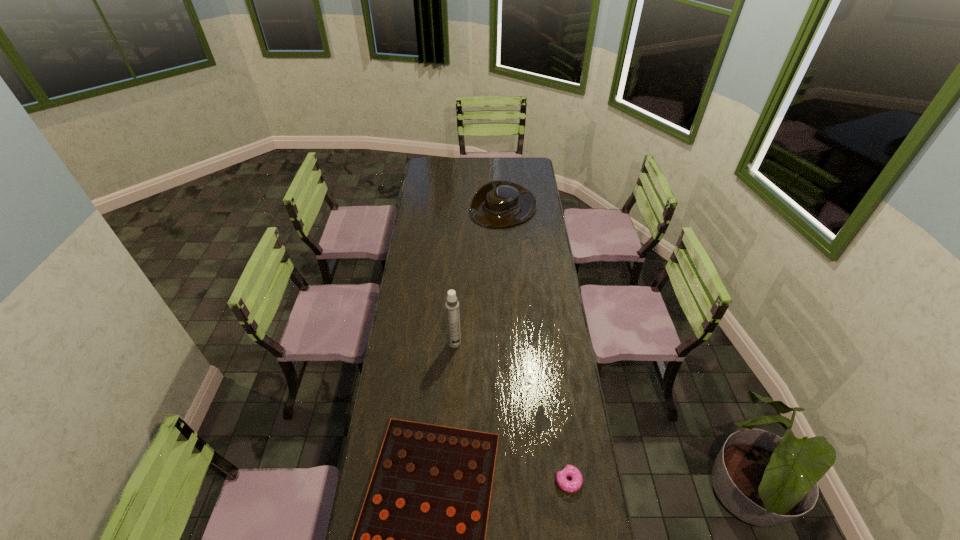
You are a GUI agent. You are given a task and a screenshot of the screen. Output one action in this format:
    pyautogui.click(x=<x>, y=<y>)
    Task: Click on the vacant region at the far edge of the desktop
    The image size is (960, 540).
    Given the screenshot: What is the action you would take?
    pyautogui.click(x=458, y=164)

The width and height of the screenshot is (960, 540). In the image, there is a desktop. Identify the location of vacant space at the left edge. (414, 275).

Identify the location of vacant space at the right edge of the desktop. (592, 522).

You are a GUI agent. You are given a task and a screenshot of the screen. Output one action in this format:
    pyautogui.click(x=<x>, y=<y>)
    Task: Click on the blank area at the far left corner
    The image size is (960, 540).
    Given the screenshot: What is the action you would take?
    pyautogui.click(x=436, y=172)

You are a GUI agent. You are given a task and a screenshot of the screen. Output one action in this format:
    pyautogui.click(x=<x>, y=<y>)
    Task: Click on the vacant area at the far right corner
    The height and width of the screenshot is (540, 960).
    Given the screenshot: What is the action you would take?
    pyautogui.click(x=514, y=158)

Locate an element on the screen. Image resolution: width=960 pixels, height=540 pixels. free space between the farthest object and the shortest object is located at coordinates (536, 345).

The image size is (960, 540). I want to click on free space between the farthest object and the doughnut, so click(536, 345).

The height and width of the screenshot is (540, 960). I want to click on vacant space that's between the aerosol can and the farthest object, so click(479, 275).

Where is `vacant region between the cowboy hat and the aerosol can`? vacant region between the cowboy hat and the aerosol can is located at coordinates (479, 275).

Find the location of `free space between the third shortest object and the shortest object`. free space between the third shortest object and the shortest object is located at coordinates (536, 345).